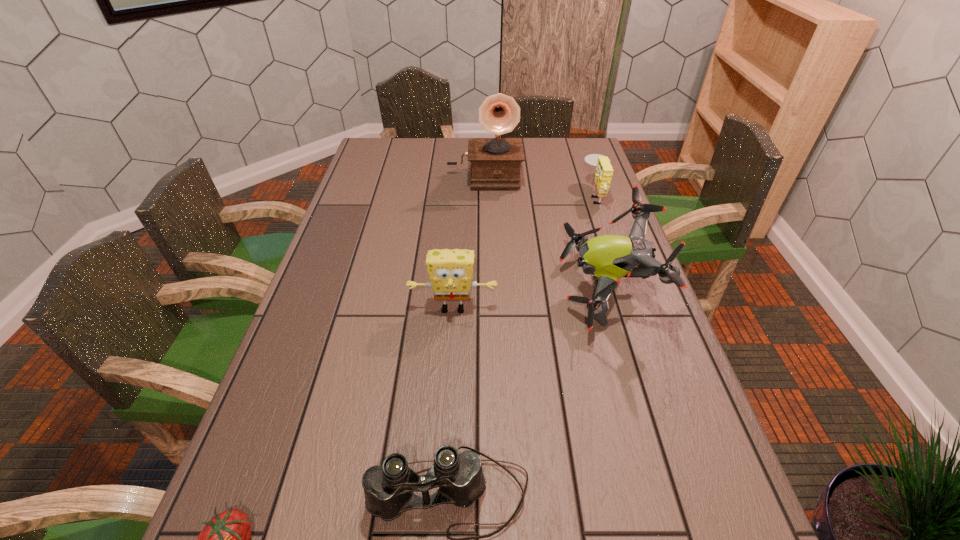
This screenshot has width=960, height=540. Find the location of `vacant area located 0.150m on the face of the fourth shortest object`. vacant area located 0.150m on the face of the fourth shortest object is located at coordinates (449, 370).

The height and width of the screenshot is (540, 960). In order to click on free space located on the front-facing side of the farther sponge in this screenshot , I will do `click(549, 195)`.

In order to click on free space located on the front-facing side of the farther sponge in this screenshot , I will do `click(546, 195)`.

Where is `vacant region located on the front-facing side of the farther sponge`? This screenshot has height=540, width=960. vacant region located on the front-facing side of the farther sponge is located at coordinates (555, 195).

What are the coordinates of `object that is at the far edge` in the screenshot? It's located at (495, 162).

Image resolution: width=960 pixels, height=540 pixels. I want to click on drone situated at the right edge, so click(609, 258).

Image resolution: width=960 pixels, height=540 pixels. What are the coordinates of `sponge that is at the right edge` in the screenshot? It's located at (604, 172).

Locate an element on the screen. The height and width of the screenshot is (540, 960). free space at the far edge of the desktop is located at coordinates (408, 163).

Locate an element on the screen. The height and width of the screenshot is (540, 960). blank space at the left edge of the desktop is located at coordinates (342, 361).

In the image, there is a desktop. Identify the location of free region at the right edge. The height and width of the screenshot is (540, 960). (600, 213).